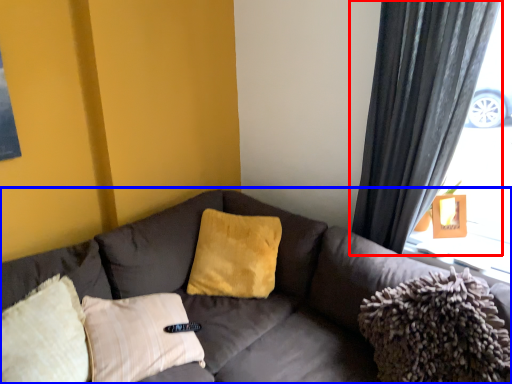
Question: Which object is further to the camera taking this photo, curtain (highlighted by a red box) or studio couch (highlighted by a blue box)?

Choices:
 (A) curtain
 (B) studio couch

Answer: (A)